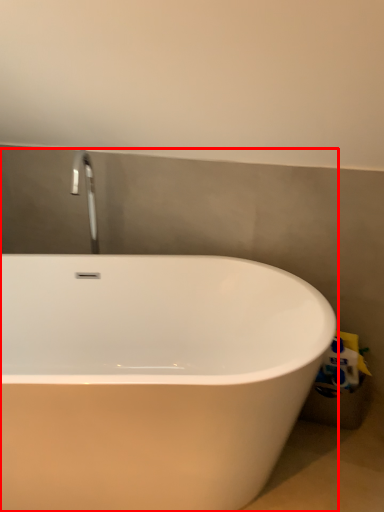
Question: From the image's perspective, what is the correct spatial relationship of bathtub (annotated by the red box) in relation to toilet paper?

Choices:
 (A) above
 (B) below

Answer: (B)